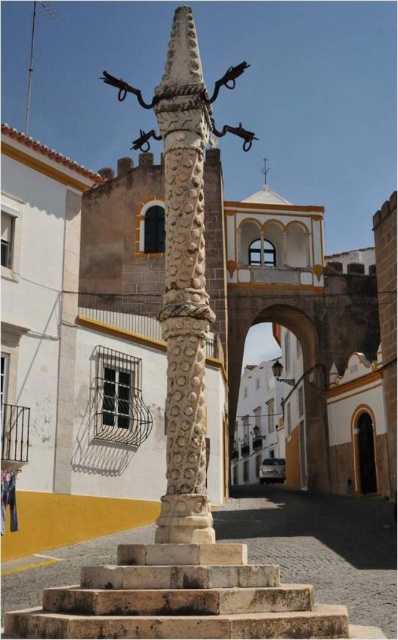
You are standing in the town square and see the point marked at coordinates (185, 275). Based on the scene description, what object is this point located on?

The point is located on the white carved stone totem pole at center, as stated in the objects description.

You are a delivery person with a cart that is 2 meters wide. You need to navigate through the space between the white carved stone totem pole at center and the stone stairs at center to reach the archway in the background. Can your cart fit through the gap between them?

The gap between the white carved stone totem pole at center and the stone stairs at center is 6.37 meters. Since your cart is only 2 meters wide, it can easily fit through the gap between them.